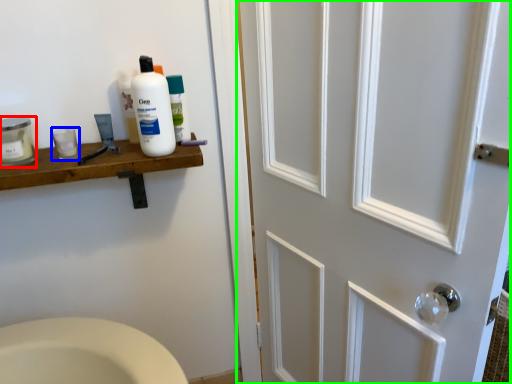
Question: Which is nearer to the mouthwash (highlighted by a red box)? mouthwash (highlighted by a blue box) or door (highlighted by a green box).

Choices:
 (A) mouthwash
 (B) door

Answer: (A)